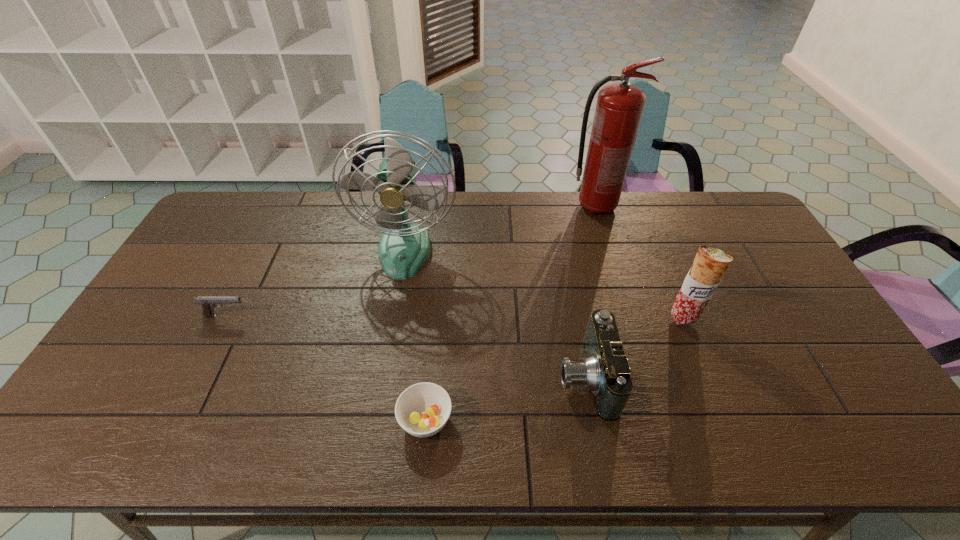
This screenshot has height=540, width=960. What are the coordinates of `blank region between the fire extinguisher and the second farthest object` in the screenshot? It's located at pyautogui.click(x=500, y=228).

This screenshot has height=540, width=960. What are the coordinates of `free spot between the shortest object and the pistol` in the screenshot? It's located at (326, 368).

At what (x,y) coordinates should I click in order to perform the action: click on vacant region between the tallest object and the fourth tallest object. Please return your answer as a coordinate pair (x, y). This screenshot has width=960, height=540. Looking at the image, I should click on (590, 292).

Find the location of a particular element. The image size is (960, 540). vacant area that lies between the third shortest object and the leftmost object is located at coordinates (405, 346).

I want to click on free space between the fifth nearest object and the pistol, so click(316, 282).

Where is `object that is the fifth closest to the second tallest object`? object that is the fifth closest to the second tallest object is located at coordinates (710, 264).

Where is `object that stands as the third closest to the second tallest object`? The height and width of the screenshot is (540, 960). object that stands as the third closest to the second tallest object is located at coordinates (619, 108).

This screenshot has width=960, height=540. What are the coordinates of `vacant space that satisfies the following two spatial constraints: 1. in front of the rightmost object, directing airflow; 2. on the left side of the fifth nearest object` in the screenshot? It's located at (394, 318).

Where is `vacant space that satisfies the following two spatial constraints: 1. at the barrel of the fourth shortest object; 2. on the right side of the leftmost object`? Image resolution: width=960 pixels, height=540 pixels. vacant space that satisfies the following two spatial constraints: 1. at the barrel of the fourth shortest object; 2. on the right side of the leftmost object is located at coordinates (226, 318).

The image size is (960, 540). I want to click on free spot that satisfies the following two spatial constraints: 1. on the back side of the fourth shortest object; 2. at the barrel of the pistol, so click(x=682, y=316).